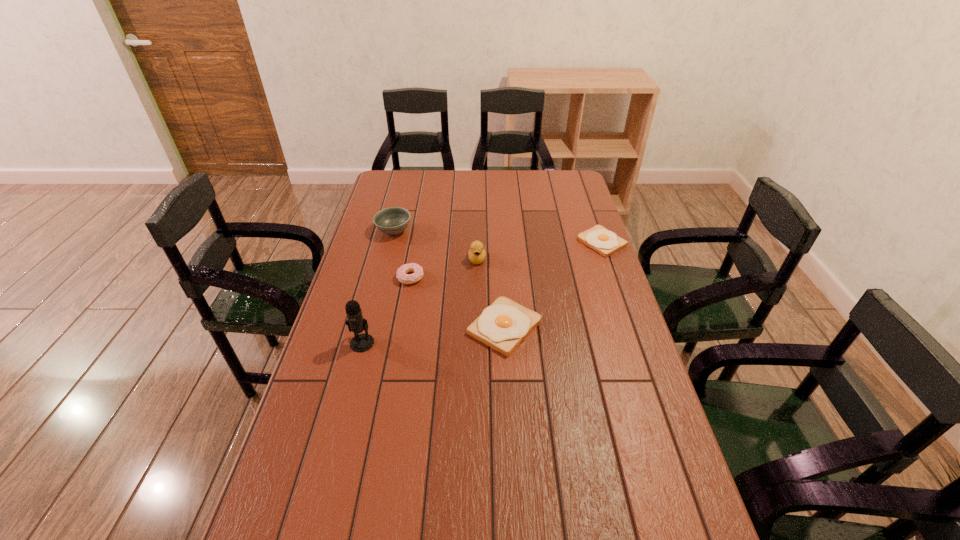
Image resolution: width=960 pixels, height=540 pixels. Find the location of `free region located on the back of the doughnut`. free region located on the back of the doughnut is located at coordinates (415, 258).

Locate an element on the screen. The height and width of the screenshot is (540, 960). blank space located 0.110m facing forward on the fifth shortest object is located at coordinates click(x=477, y=289).

This screenshot has width=960, height=540. I want to click on free location located on the front of the third tallest object, so click(x=373, y=313).

Identify the location of vacant space located 0.240m on the back of the tallest object. (378, 281).

Where is `bowl at the left edge`? bowl at the left edge is located at coordinates (393, 220).

The width and height of the screenshot is (960, 540). What are the coordinates of `microphone present at the left edge` in the screenshot? It's located at (356, 323).

The height and width of the screenshot is (540, 960). What are the coordinates of `object at the right edge` in the screenshot? It's located at (605, 242).

This screenshot has height=540, width=960. In the image, there is a desktop. In order to click on vacant area at the far edge in this screenshot , I will do `click(468, 184)`.

What are the coordinates of `blank space at the left edge` in the screenshot? It's located at (380, 199).

This screenshot has width=960, height=540. Find the location of `vacant position at the right edge of the desktop`. vacant position at the right edge of the desktop is located at coordinates (637, 418).